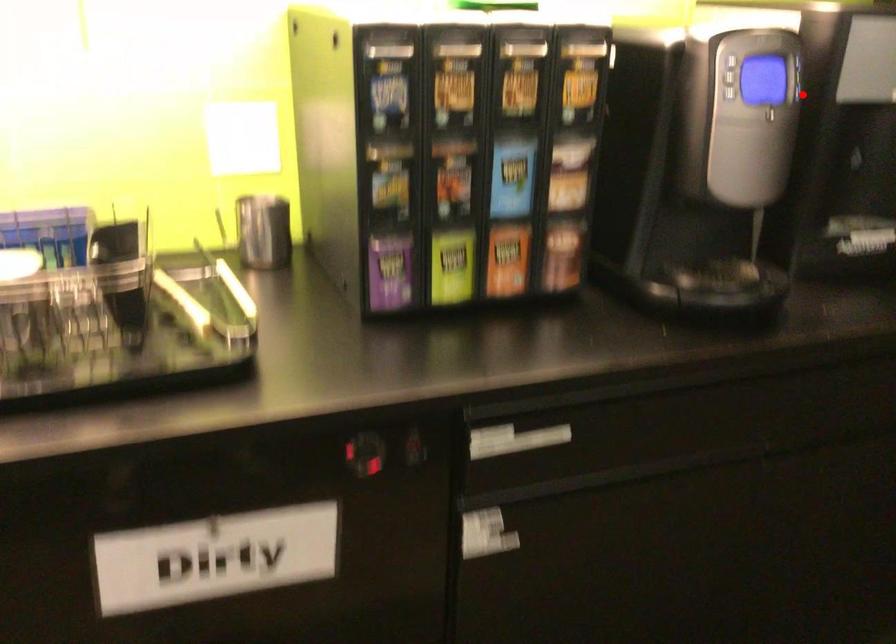
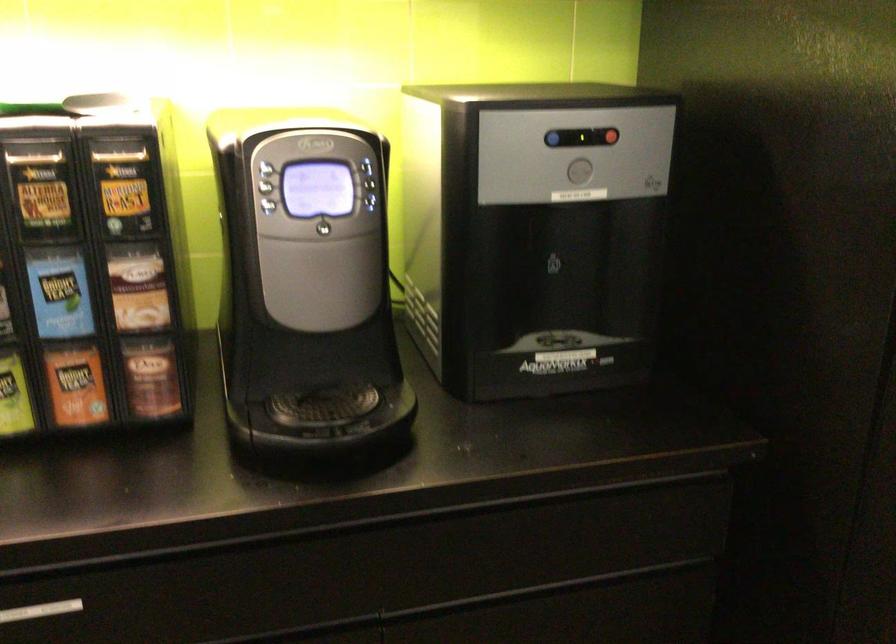
Question: I am providing you with two images of the same scene from different viewpoints. A red point is shown in image1. For the corresponding object point in image2, is it positioned nearer or farther from the camera?

Choices:
 (A) Nearer
 (B) Farther

Answer: (A)